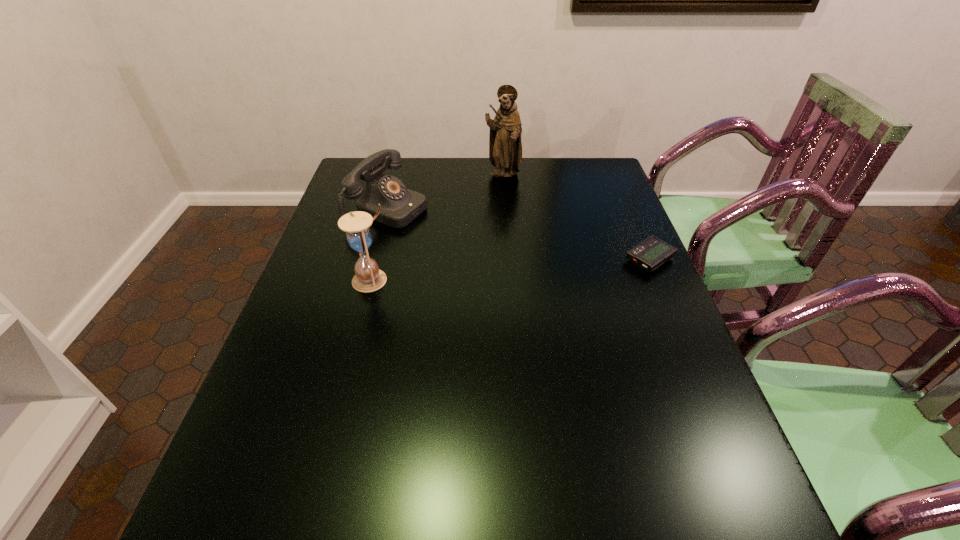
Find the location of a particular element. blank space that satisfies the following two spatial constraints: 1. on the front side of the third tallest object; 2. on the left side of the hourglass is located at coordinates (370, 280).

Where is `free location that satisfies the following two spatial constraints: 1. on the front side of the third shortest object; 2. on the right side of the telephone`? free location that satisfies the following two spatial constraints: 1. on the front side of the third shortest object; 2. on the right side of the telephone is located at coordinates 370,280.